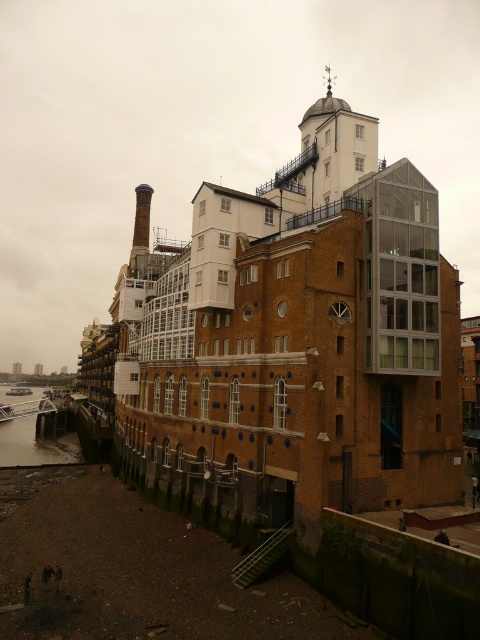
From the picture: You are standing at the point marked as point (35, 444) in the image. What is the nearest object to you in the scene?

The nearest object to you at point (35, 444) is the greenish water at lower left, as the coordinates directly correspond to that location.

You are standing at the point marked as point (297, 339) in the image. What is the nearest object to you?

The nearest object to you is the brown brick building at center located at point (297, 339).

You are standing at the waterfront and looking at the building. There are two points marked on the building facade. The first point is at coordinates point (311, 289) and the second is at point (78, 458). Which of these two points is closer to you?

Point (311, 289) is in front of point (78, 458), so the first point is closer to you.